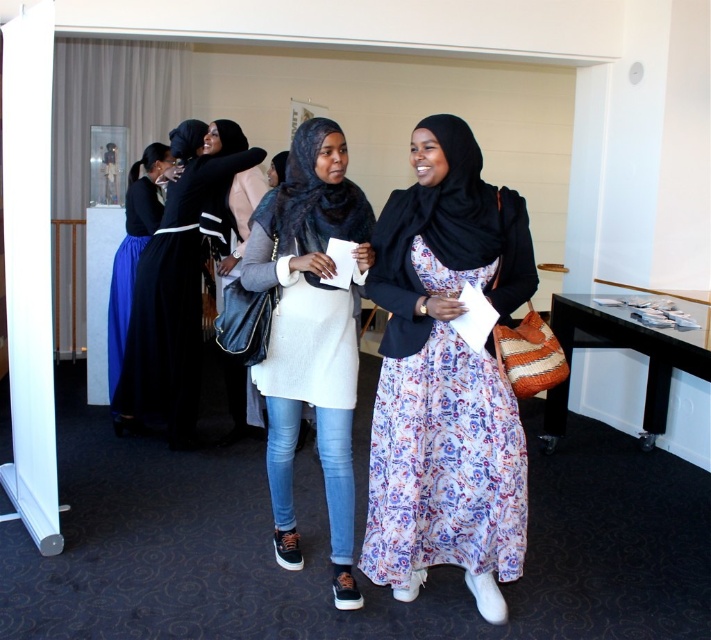
Who is more distant from viewer, (368, 518) or (181, 227)?

The point (181, 227) is more distant.

Between floral silk dress at center and matte black hijab at center, which one has less height?

floral silk dress at center

Where is `floral silk dress at center`? The height and width of the screenshot is (640, 711). floral silk dress at center is located at coordinates (444, 465).

Who is shorter, matte black hijab at center or white textured dress at center?

Standing shorter between the two is white textured dress at center.

Which is in front, point (186, 392) or point (272, 266)?

Positioned in front is point (272, 266).

The height and width of the screenshot is (640, 711). Identify the location of matte black hijab at center. (178, 284).

Who is shorter, white textured dress at center or matte black dress at left?

Standing shorter between the two is white textured dress at center.

Measure the distance between white textured dress at center and matte black dress at left.

The distance of white textured dress at center from matte black dress at left is 1.70 meters.

Between point (262, 244) and point (138, 241), which one is positioned behind?

The point (138, 241) is more distant.

What are the coordinates of `white textured dress at center` in the screenshot? It's located at (301, 323).